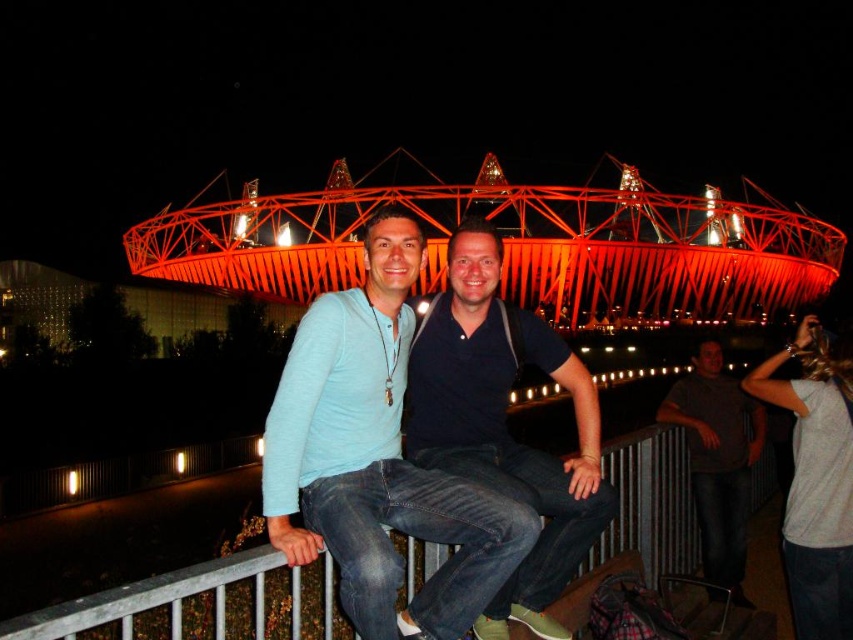
You are a photographer trying to capture a photo of the light blue denim jeans at center and the white cotton shirt at lower right. Which object should you focus on first if you want to ensure both are in sharp focus?

You should focus on the light blue denim jeans at center first because it is taller than the white cotton shirt at lower right, so it requires a closer focus distance.